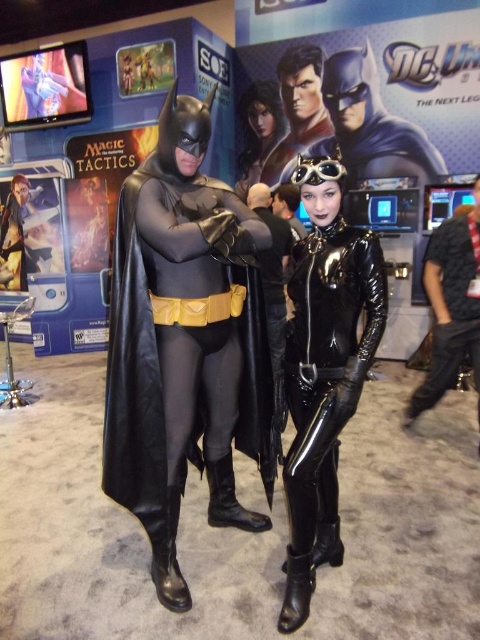
In the scene shown: You are at a convention and see the matte black costume at center. Can you tell me its exact location in the image using coordinates?

The matte black costume at center is located at coordinates point [186,339].

You are a photographer at the event and need to position the two cosplayers so that their costumes do not overlap in the photo. The matte black costume at center and the black latex bodysuit at center are currently overlapping. Based on their widths, which costume should you move to the left to avoid overlap?

The matte black costume at center might be wider than black latex bodysuit at center, so moving the black latex bodysuit at center to the left would help avoid overlap since it is narrower.